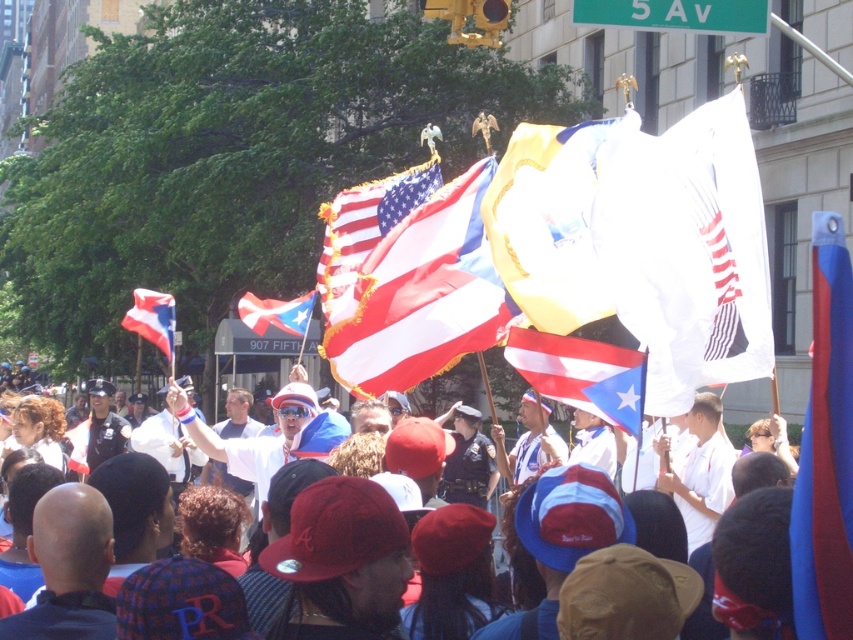
Can you confirm if yellow satin flag at center is positioned to the left of red and white striped flag at center?

In fact, yellow satin flag at center is to the right of red and white striped flag at center.

Is yellow satin flag at center wider than red and white striped flag at center?

No, yellow satin flag at center is not wider than red and white striped flag at center.

Is point (521, 138) closer to camera compared to point (172, 346)?

Yes.

Where is `yellow satin flag at center`? yellow satin flag at center is located at coordinates (550, 221).

Between point (329, 349) and point (807, 614), which one is positioned in front?

Point (807, 614) is in front.

Does matte fabric flag at center have a smaller size compared to blue/red striped flag at right?

Yes.

Who is more distant from viewer, (352, 324) or (825, 593)?

The point (352, 324) is behind.

Where is `matte fabric flag at center`? The width and height of the screenshot is (853, 640). matte fabric flag at center is located at coordinates (421, 294).

Is point (625, 248) positioned behind point (364, 252)?

No.

Who is positioned more to the right, white fabric flag at upper center or matte american flag at center?

Positioned to the right is white fabric flag at upper center.

Is point (746, 182) more distant than point (328, 316)?

That is False.

Image resolution: width=853 pixels, height=640 pixels. Identify the location of white fabric flag at upper center. (688, 250).